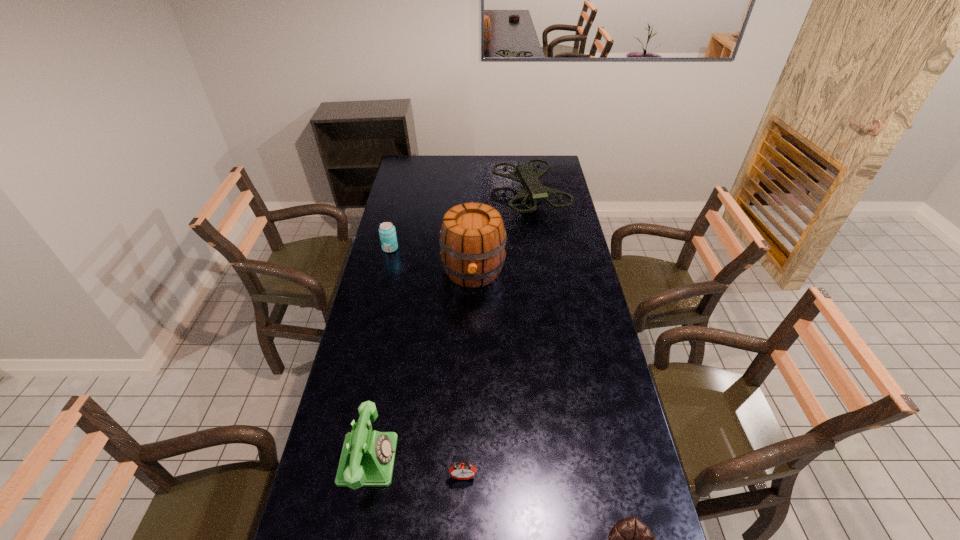
I want to click on cider, so click(x=472, y=237).

What are the coordinates of `drone` in the screenshot? It's located at (533, 190).

The height and width of the screenshot is (540, 960). What are the coordinates of `telephone` in the screenshot? It's located at (367, 459).

This screenshot has width=960, height=540. In order to click on the third shortest object in this screenshot , I will do tap(387, 232).

Identify the location of alarm clock. The height and width of the screenshot is (540, 960). (462, 471).

At what (x,y) coordinates should I click in order to perform the action: click on free point located 0.210m on the side of the cider where the spigot is located. Please return your answer as a coordinate pair (x, y). The image size is (960, 540). Looking at the image, I should click on (472, 336).

Locate an element on the screen. free space located 0.080m on the left of the drone is located at coordinates (477, 196).

Locate an element on the screen. Image resolution: width=960 pixels, height=540 pixels. free space located 0.130m on the dial of the telephone is located at coordinates (441, 459).

Where is `blank space located on the back of the beer can`? The height and width of the screenshot is (540, 960). blank space located on the back of the beer can is located at coordinates (396, 221).

Locate an element on the screen. The image size is (960, 540). vacant space located on the clock face of the alarm clock is located at coordinates click(462, 534).